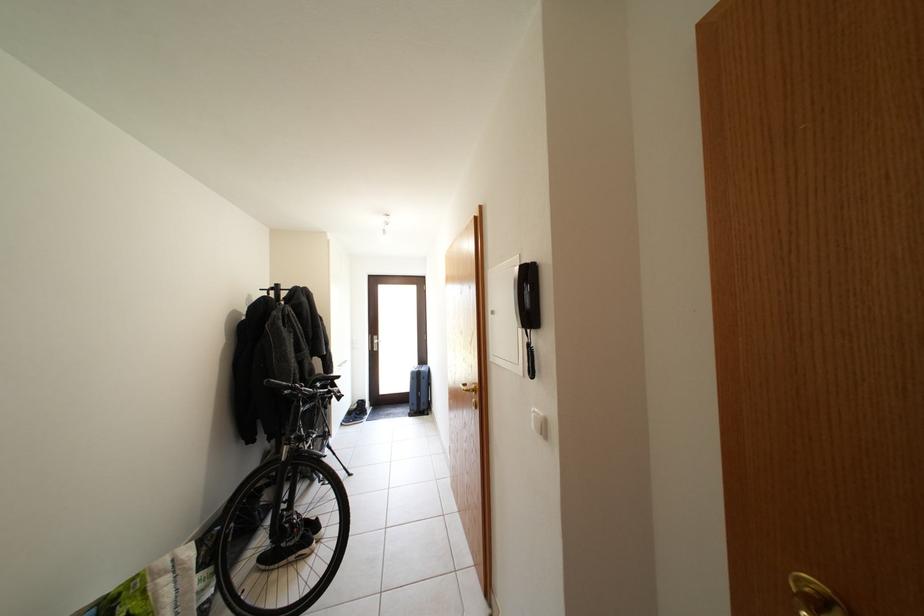
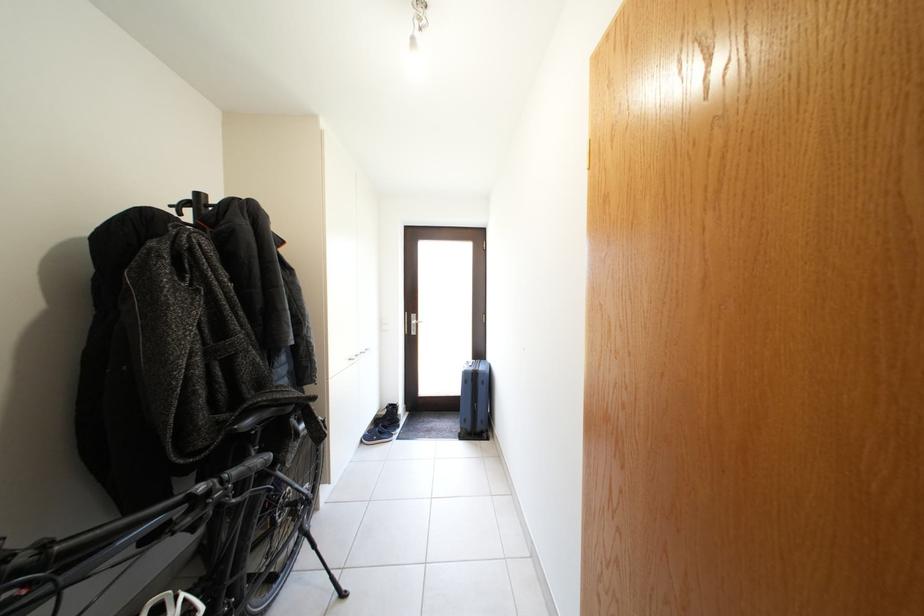
Locate, in the second image, the point that corresponds to (x=365, y=419) in the first image.

(392, 431)